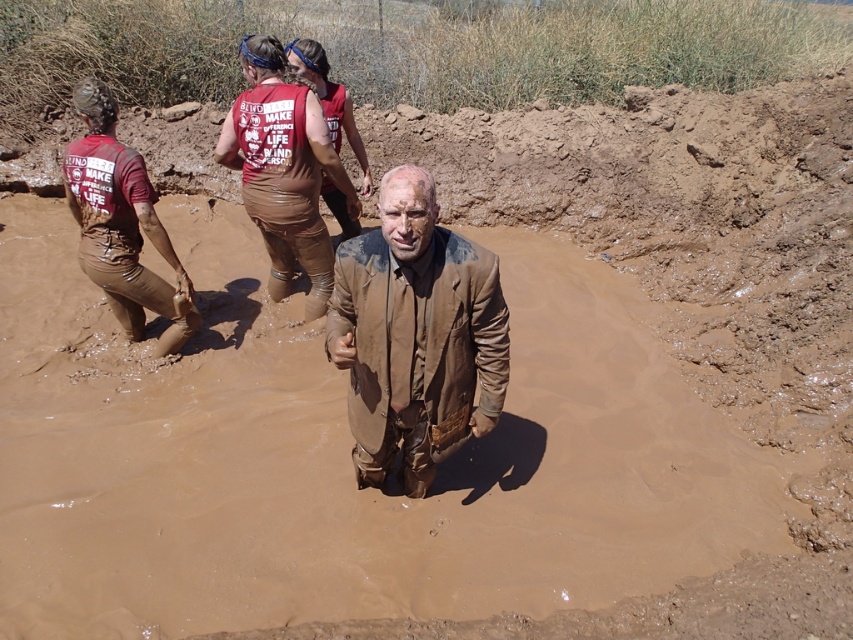
You are a photographer at the mud run event. You want to capture a photo of the matte brown vest at center and muddy brown pants at left. Based on their positions, which object should appear closer to the camera in your photo?

The matte brown vest at center should appear closer to the camera in the photo because the muddy brown pants at left is behind it.

In the scene of the mud run event, there is a muddy brown suit at center and a matte brown vest at center. From the perspective of someone facing the same direction as the camera, which object is positioned to the left?

The matte brown vest at center is to the left of the muddy brown suit at center.

You are a photographer at the obstacle course event. You need to capture a closeup of the muddy brown suit at center and the matte brown vest at center. Since your camera has a limited focus range, which one should you focus on first to ensure both are in frame?

The muddy brown suit at center has a lesser width compared to matte brown vest at center, so you should focus on the muddy brown suit at center first to ensure both are in frame.